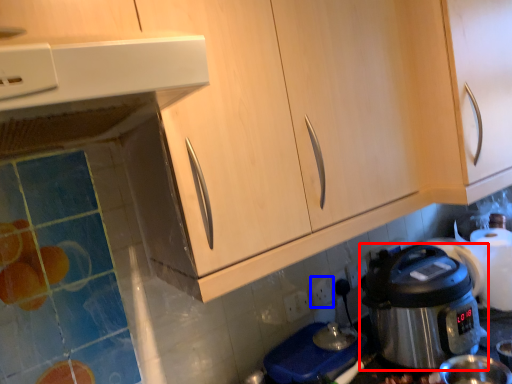
Question: Which of the following is the closest to the observer, rice cooker (highlighted by a red box) or electric outlet (highlighted by a blue box)?

Choices:
 (A) rice cooker
 (B) electric outlet

Answer: (A)